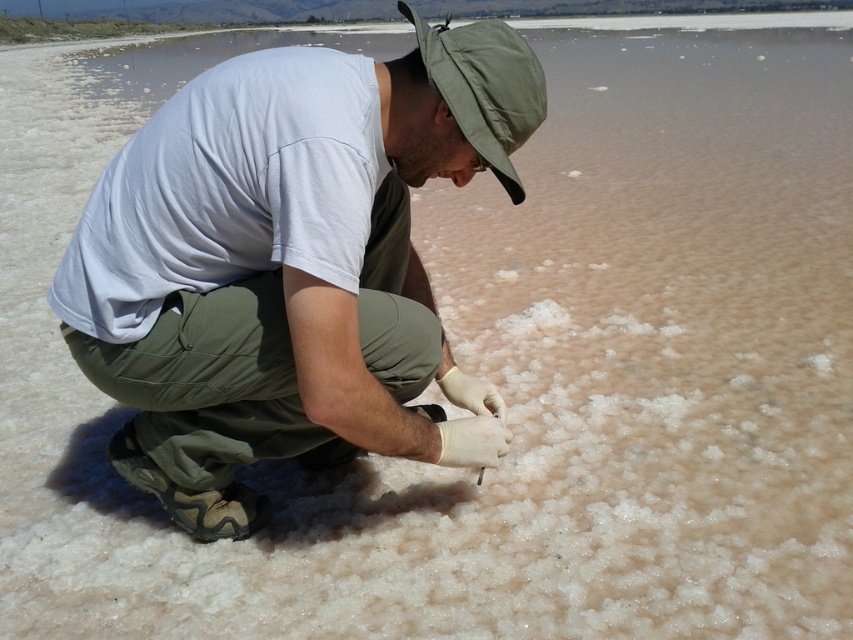
Who is positioned more to the left, matte khaki pants at center or green fabric hat at center?

Positioned to the left is matte khaki pants at center.

Where is `matte khaki pants at center`? matte khaki pants at center is located at coordinates (288, 264).